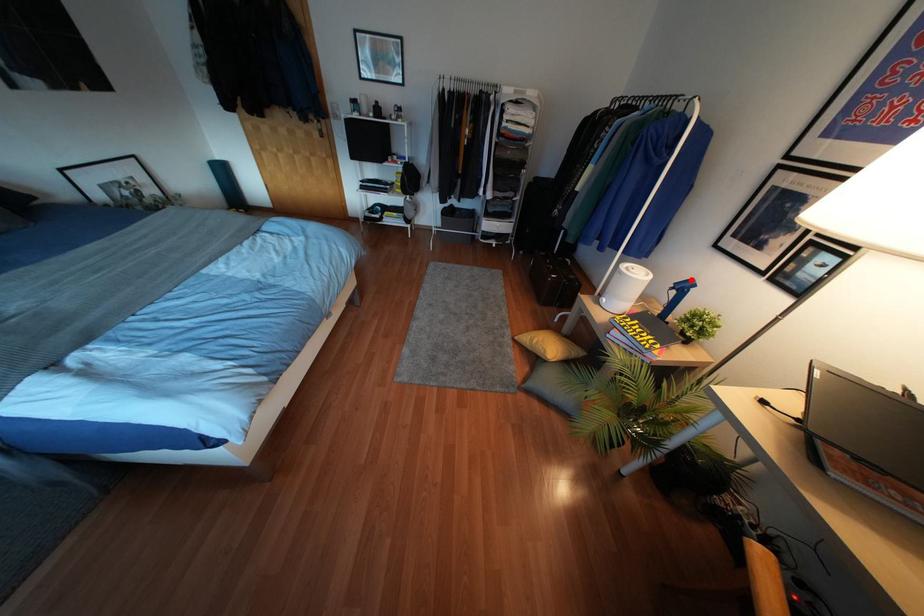
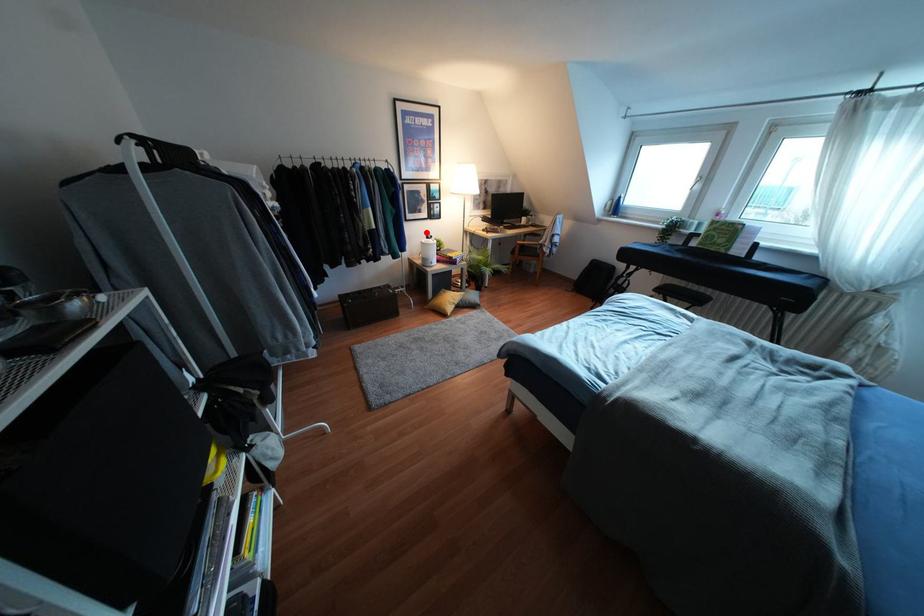
I am providing you with two images of the same scene from different viewpoints. A red point is marked on the first image and another point is marked on the second image. Do the highlighted points in image1 and image2 indicate the same real-world spot?

Yes